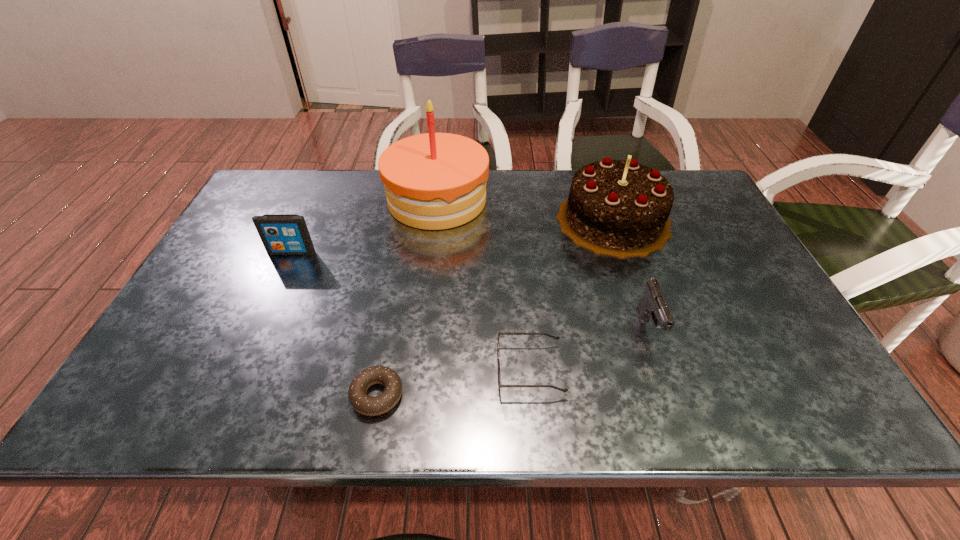
The width and height of the screenshot is (960, 540). In order to click on free space located 0.080m on the front of the fifth shortest object in this screenshot , I will do `click(634, 280)`.

Locate an element on the screen. The height and width of the screenshot is (540, 960). vacant space located on the front screen of the leftmost object is located at coordinates 285,268.

Identify the location of blank area located 0.130m at the barrel of the pistol. The image size is (960, 540). (677, 406).

This screenshot has width=960, height=540. In order to click on free space located on the front lenses of the sunglasses in this screenshot , I will do `click(379, 369)`.

Where is `free region located on the front lenses of the sunglasses`? free region located on the front lenses of the sunglasses is located at coordinates (327, 369).

Find the location of `vacant space located on the front lenses of the sunglasses`. vacant space located on the front lenses of the sunglasses is located at coordinates (324, 369).

What are the coordinates of `vacant space located 0.200m on the left of the doughnut` in the screenshot? It's located at (252, 395).

Image resolution: width=960 pixels, height=540 pixels. In order to click on sunglasses at the near edge in this screenshot , I will do `click(500, 385)`.

Locate an element on the screen. doughnut at the near edge is located at coordinates (371, 406).

The width and height of the screenshot is (960, 540). Find the location of `object located in the left edge section of the desktop`. object located in the left edge section of the desktop is located at coordinates (281, 234).